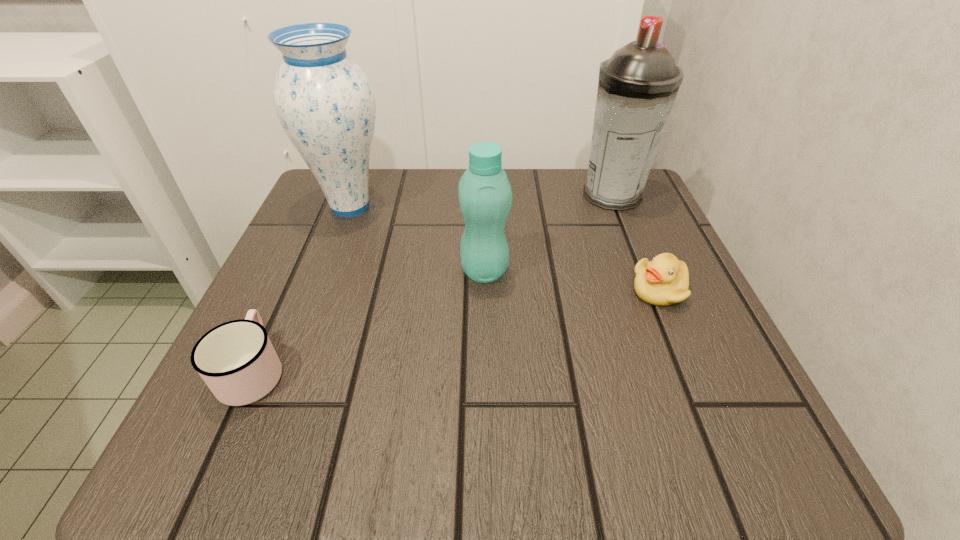
Identify the location of blank space at the far right corner of the desktop. (626, 229).

Identify the location of free region at the near right corner of the desktop. Image resolution: width=960 pixels, height=540 pixels. click(767, 427).

The height and width of the screenshot is (540, 960). I want to click on free space between the mug and the aerosol can, so click(x=433, y=283).

The height and width of the screenshot is (540, 960). Identify the location of vacant area that lies between the third object from left to right and the vase. (418, 239).

Find the location of a particular element. This screenshot has width=960, height=540. free spot between the bottle and the aerosol can is located at coordinates (548, 233).

Locate an element on the screen. The width and height of the screenshot is (960, 540). free space between the nearest object and the duckling is located at coordinates (456, 330).

Locate an element on the screen. The image size is (960, 540). unoccupied position between the third object from left to right and the aerosol can is located at coordinates (548, 233).

This screenshot has height=540, width=960. I want to click on vacant space that's between the aerosol can and the mug, so click(433, 283).

Find the location of `free area in between the mug and the vase`. free area in between the mug and the vase is located at coordinates (301, 288).

Where is `free spot between the vase and the third shortest object`? The image size is (960, 540). free spot between the vase and the third shortest object is located at coordinates (418, 239).